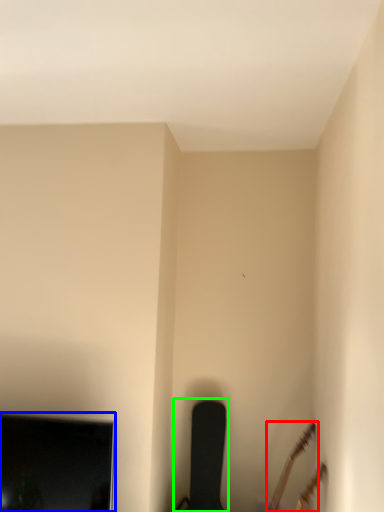
Question: Based on their relative distances, which object is nearer to guitar (highlighted by a red box)? Choose from television (highlighted by a blue box) and chair (highlighted by a green box).

Choices:
 (A) television
 (B) chair

Answer: (B)